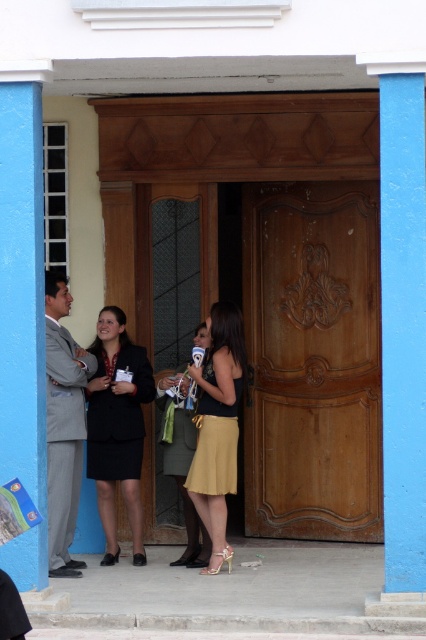
Where is `wooden carved door at center`? The image size is (426, 640). wooden carved door at center is located at coordinates (313, 360).

Is wooden carved door at center to the right of gold satin skirt at center from the viewer's perspective?

Indeed, wooden carved door at center is positioned on the right side of gold satin skirt at center.

The width and height of the screenshot is (426, 640). I want to click on wooden carved door at center, so click(313, 360).

Is wooden carved door at center below gray suit at left?

No.

At what (x,y) coordinates should I click in order to perform the action: click on wooden carved door at center. Please return your answer as a coordinate pair (x, y). This screenshot has width=426, height=640. Looking at the image, I should click on (313, 360).

Describe the element at coordinates (117, 428) in the screenshot. I see `black fabric skirt at center` at that location.

Does black fabric skirt at center have a greater width compared to gold satin skirt at center?

Yes.

Does point (120, 358) lie in front of point (224, 470)?

No, (120, 358) is behind (224, 470).

Where is `black fabric skirt at center`? The height and width of the screenshot is (640, 426). black fabric skirt at center is located at coordinates (117, 428).